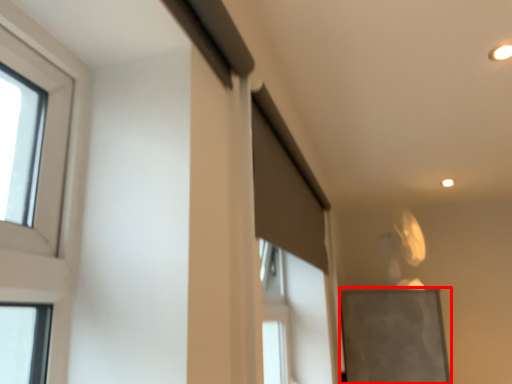
Question: From the image's perspective, what is the correct spatial positioning of bulletin board (annotated by the red box) in reference to screen door?

Choices:
 (A) below
 (B) above

Answer: (A)